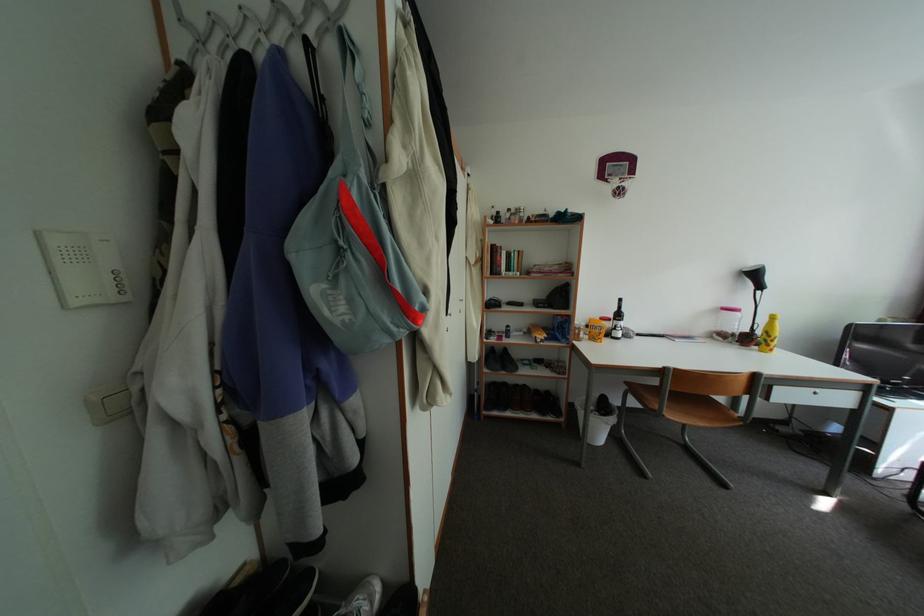
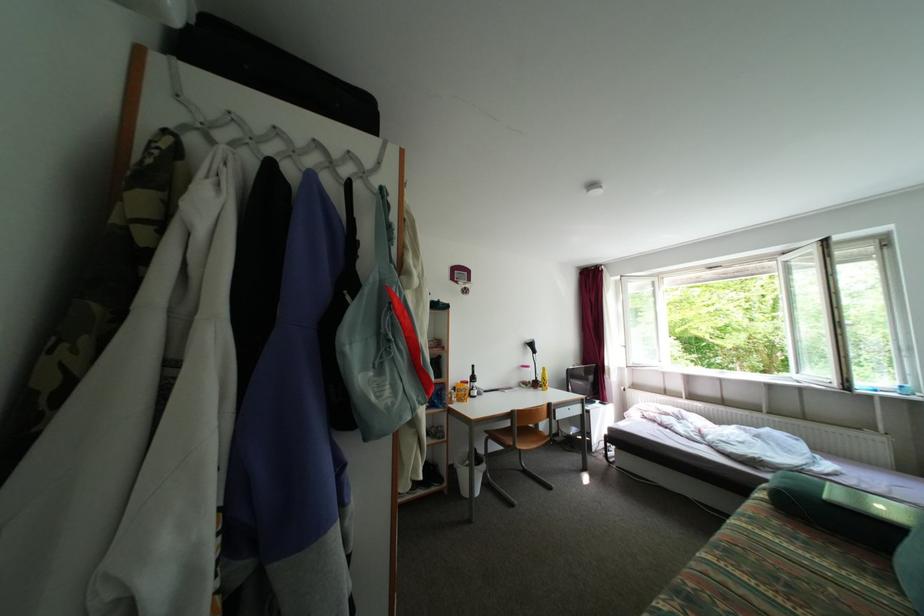
Question: The images are taken continuously from a first-person perspective. In which direction is your viewpoint rotating?

Choices:
 (A) Left
 (B) Right
 (C) Up
 (D) Down

Answer: (B)